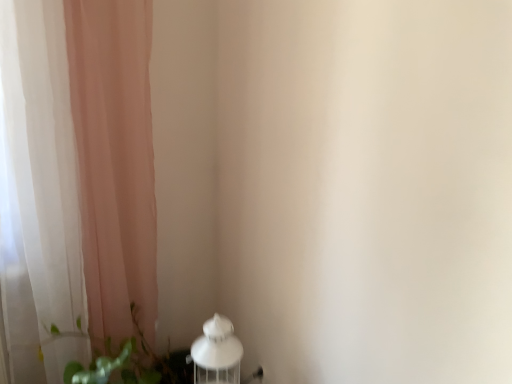
Question: From a real-world perspective, relative to green leafy plant at lower left, is sheer pink curtain at left vertically above or below?

Choices:
 (A) above
 (B) below

Answer: (A)

Question: Considering the positions of point (99, 81) and point (144, 347), is point (99, 81) closer or farther from the camera than point (144, 347)?

Choices:
 (A) farther
 (B) closer

Answer: (B)

Question: Which is farther from the sheer pink curtain at left?

Choices:
 (A) green leafy plant at lower left
 (B) white matte table lamp at lower left

Answer: (B)

Question: Estimate the real-world distances between objects in this image. Which object is farther from the green leafy plant at lower left?

Choices:
 (A) white matte table lamp at lower left
 (B) sheer pink curtain at left

Answer: (B)